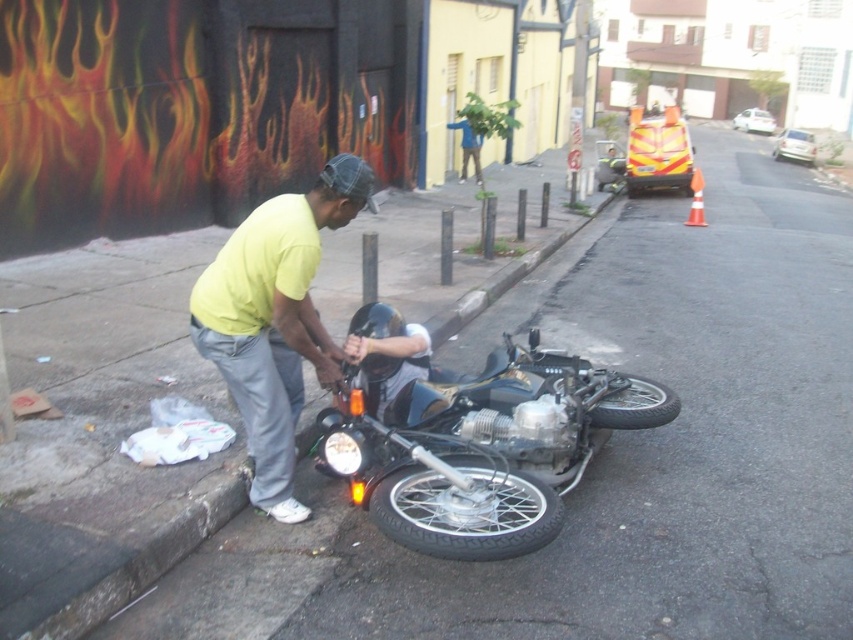
Does yellow matte shirt at center have a lesser width compared to black rubber tire at lower center?

No.

The height and width of the screenshot is (640, 853). What are the coordinates of `yellow matte shirt at center` in the screenshot? It's located at (276, 321).

Between point (279, 394) and point (440, 480), which one is positioned in front?

Point (440, 480)

At what (x,y) coordinates should I click in order to perform the action: click on yellow matte shirt at center. Please return your answer as a coordinate pair (x, y). The height and width of the screenshot is (640, 853). Looking at the image, I should click on (276, 321).

Based on the photo, does yellow matte shirt at center come behind black rubber tire at lower right?

No, yellow matte shirt at center is closer to the viewer.

Is point (277, 211) more distant than point (599, 419)?

No, it is in front of (599, 419).

Identify the location of yellow matte shirt at center. The image size is (853, 640). (276, 321).

Between shiny chrome motorcycle at center and black rubber tire at lower right, which one appears on the left side from the viewer's perspective?

shiny chrome motorcycle at center is more to the left.

Who is positioned more to the right, shiny chrome motorcycle at center or black rubber tire at lower right?

Answer: black rubber tire at lower right is more to the right.

Is point (459, 538) farther from camera compared to point (650, 396)?

No.

Image resolution: width=853 pixels, height=640 pixels. Identify the location of shiny chrome motorcycle at center. (469, 436).